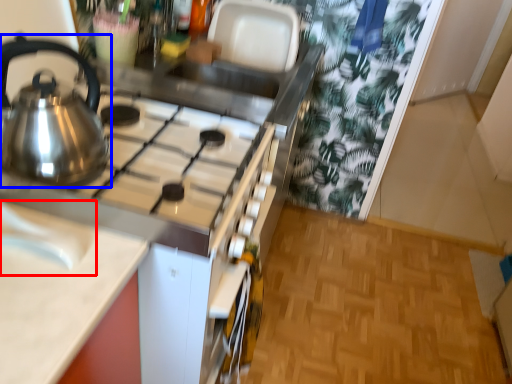
Question: Which object appears farthest to the camera in this image, sink (highlighted by a red box) or kettle (highlighted by a blue box)?

Choices:
 (A) sink
 (B) kettle

Answer: (B)